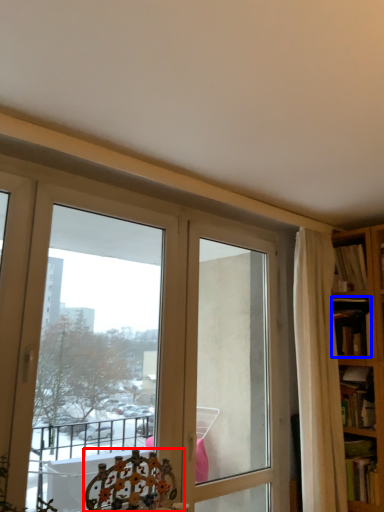
Question: Which of the following is the farthest to the observer, chair (highlighted by a red box) or book (highlighted by a blue box)?

Choices:
 (A) chair
 (B) book

Answer: (B)